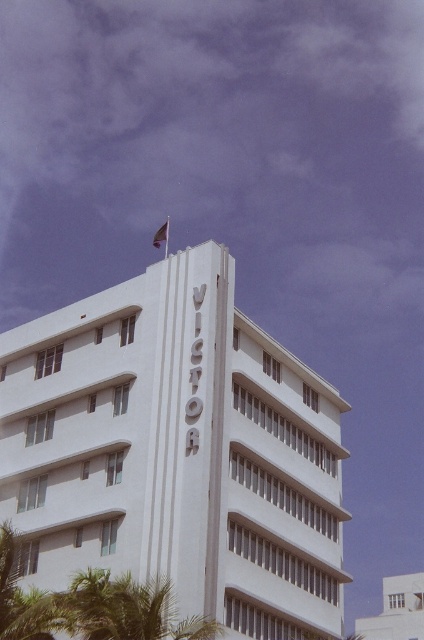
You are a photographer planning to capture the white smooth building at center and the silky red flag at upper center in a single frame. Based on their positions, which object should you focus on first to ensure both are in the frame?

The white smooth building at center is wider than the silky red flag at upper center, so you should focus on the white smooth building at center first to ensure both fit within the frame.

You are standing at the point marked as point [176,451]. Looking around, you see the white smooth building at center. Can you describe what you see at your current location?

At point [176,451] lies the white smooth building at center.

You are standing at the base of the white smooth building at center and want to place a new flagpole on the rooftop. The flagpole requires a minimum of 50 meters of space between the base and the flagpole to ensure stability. Can you safely install it?

The distance between the base and the flagpole on the rooftop of the white smooth building at center is 45.49 meters, which is less than the required 50 meters. Therefore, the flagpole cannot be safely installed with the required spacing.